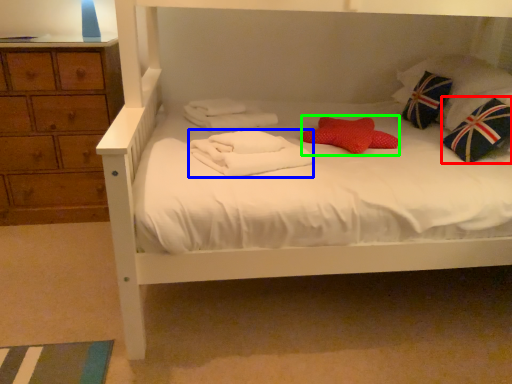
Question: Which is farther away from throw pillow (highlighted by a red box)? bath towel (highlighted by a blue box) or pillow (highlighted by a green box)?

Choices:
 (A) bath towel
 (B) pillow

Answer: (A)